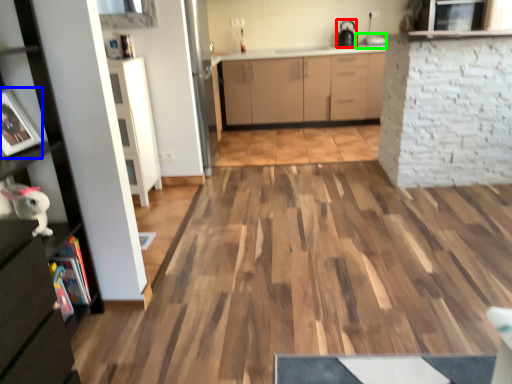
Question: Which object is positioned closest to appliance (highlighted by a red box)? Select from picture frame (highlighted by a blue box) and sink (highlighted by a green box).

Choices:
 (A) picture frame
 (B) sink

Answer: (B)